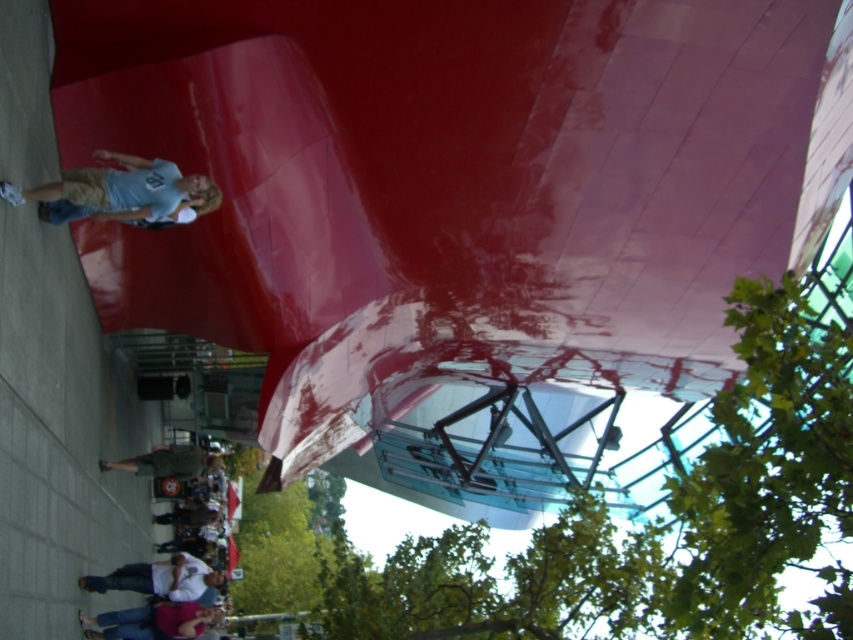
Is denim pants at lower center closer to camera compared to white matte skateboard at lower center?

Yes, it is in front of white matte skateboard at lower center.

Can you confirm if denim pants at lower center is shorter than white matte skateboard at lower center?

No.

This screenshot has height=640, width=853. What do you see at coordinates (154, 621) in the screenshot?
I see `denim pants at lower center` at bounding box center [154, 621].

Image resolution: width=853 pixels, height=640 pixels. Identify the location of denim pants at lower center. (154, 621).

Based on the photo, is light blue t-shirt at left taller than denim pants at lower center?

In fact, light blue t-shirt at left may be shorter than denim pants at lower center.

Who is shorter, light blue t-shirt at left or denim pants at lower center?

With less height is light blue t-shirt at left.

Image resolution: width=853 pixels, height=640 pixels. Identify the location of light blue t-shirt at left. (119, 188).

Who is more forward, (154, 212) or (202, 580)?

Positioned in front is point (154, 212).

Between light blue t-shirt at left and white matte skateboard at lower center, which one has less height?

With less height is light blue t-shirt at left.

Who is more forward, (106, 177) or (202, 586)?

Point (106, 177) is more forward.

Image resolution: width=853 pixels, height=640 pixels. I want to click on light blue t-shirt at left, so click(x=119, y=188).